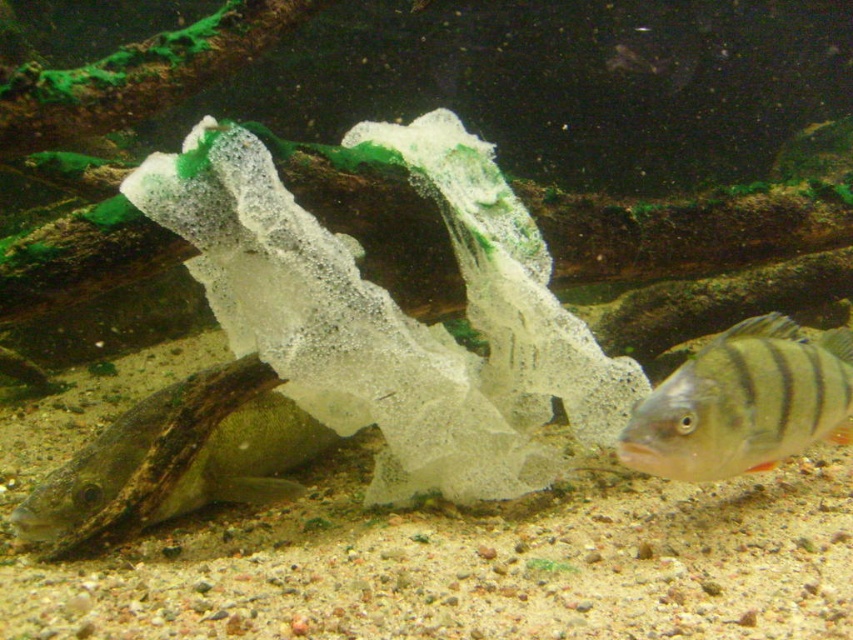
You are a marine biologist observing an underwater scene in an aquarium. You notice the smooth brown fish at lower left and the shiny silver fish at lower right. Based on their sizes, which fish would you estimate has a larger habitat requirement in the aquarium?

The smooth brown fish at lower left is bigger than the shiny silver fish at lower right, so it likely requires a larger habitat in the aquarium.

You are an underwater explorer and want to reach the point at coordinates (306, 426) in the image. The aquarium has a safety rule that you must stay within 10 feet of the entrance, which is behind you. Can you safely reach the point?

The point at coordinates (306, 426) is 8.02 feet from the viewer, which is within the 10 feet safety rule. Therefore, you can safely reach the point.